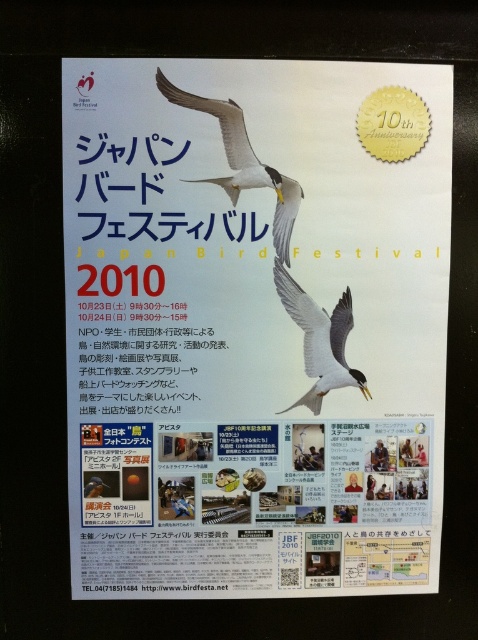
Question: Is white paper poster at upper center thinner than white glossy bird at center?

Choices:
 (A) no
 (B) yes

Answer: (A)

Question: Estimate the real-world distances between objects in this image. Which object is closer to the white paper poster at upper center?

Choices:
 (A) white glossy bird at center
 (B) white glossy seagull at upper center

Answer: (A)

Question: Does white paper poster at upper center have a lesser width compared to white glossy seagull at upper center?

Choices:
 (A) no
 (B) yes

Answer: (A)

Question: Which object appears closest to the camera in this image?

Choices:
 (A) white glossy seagull at upper center
 (B) white paper poster at upper center

Answer: (B)

Question: Is white glossy seagull at upper center above white glossy bird at center?

Choices:
 (A) yes
 (B) no

Answer: (A)

Question: Which object is the farthest from the white glossy bird at center?

Choices:
 (A) white glossy seagull at upper center
 (B) white paper poster at upper center

Answer: (B)